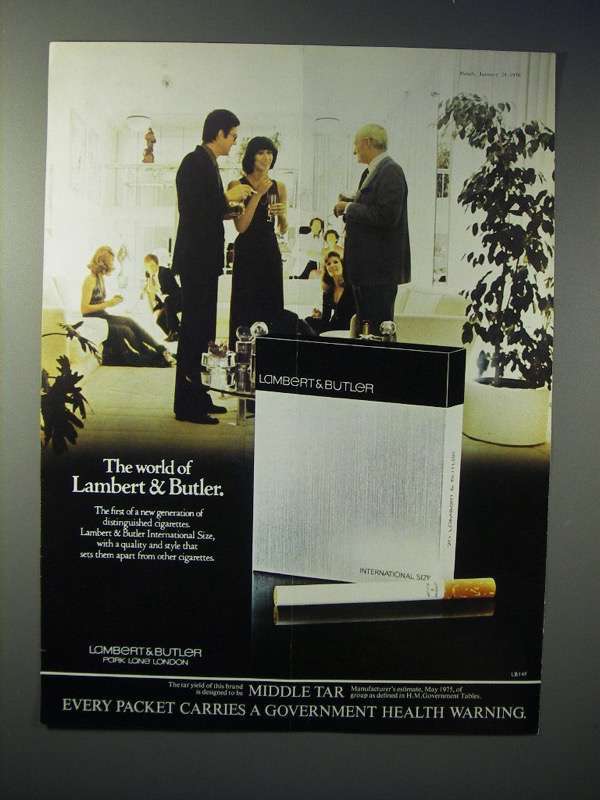
In order to click on window in this screenshot , I will do `click(439, 210)`.